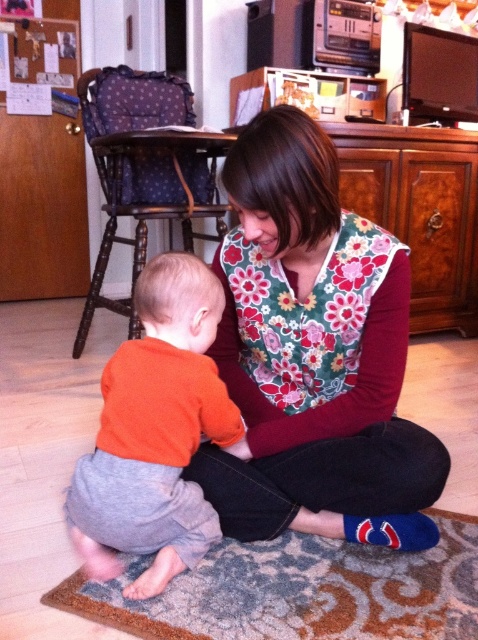
You are a delivery robot that needs to move from the point at coordinate (397, 243) to the adult. The minimum turning radius of the robot is 1.2 meters. Can the robot navigate to the adult without any obstacles?

The distance between the point at coordinate (397, 243) and the adult is 1.26 meters. Since the robot has a minimum turning radius of 1.2 meters, it can navigate to the adult as the distance is sufficient.

You are a photographer trying to capture a candid shot of the two subjects in the scene. You want to ensure both the floral fabric shirt at center and the orange cotton shirt at lower left are clearly visible in the frame. Based on their positions, which shirt should you focus on first to ensure both are in focus?

The floral fabric shirt at center is located above the orange cotton shirt at lower left, so focusing on the floral fabric shirt at center first will ensure both are in focus as they are stacked vertically.

You are a photographer setting up a camera at the same level as the floor where the orange cotton shirt at lower left and blue fuzzy socks at lower center are located. You want to capture both objects in the same frame without moving the camera. Which object will appear larger in the photo?

The orange cotton shirt at lower left will appear larger in the photo because it has a greater height compared to the blue fuzzy socks at lower center.